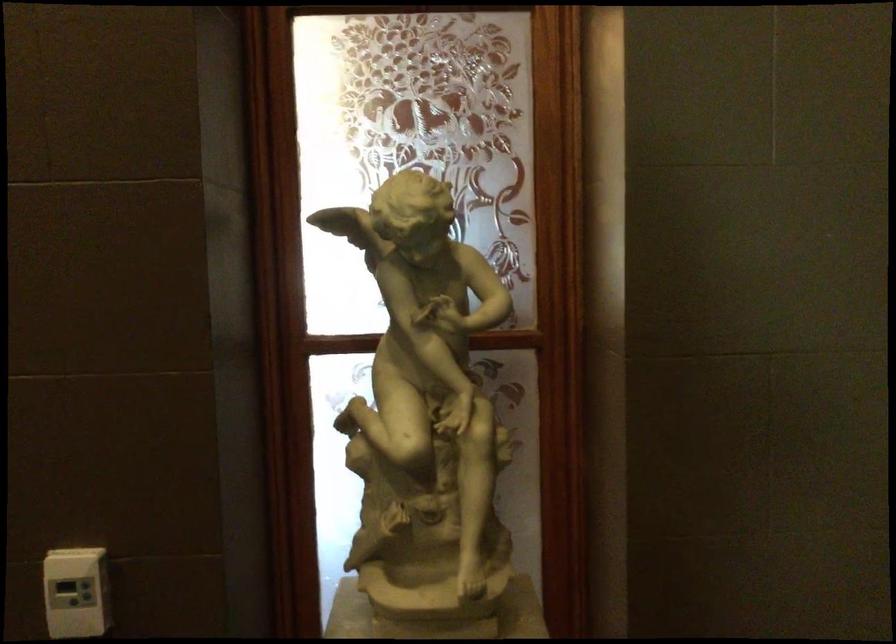
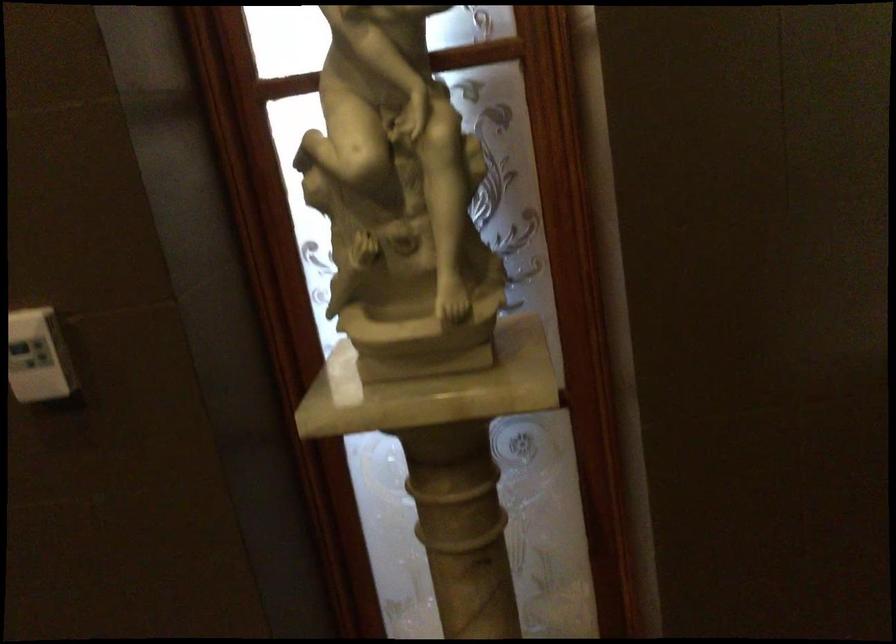
What movement of the cameraman would produce the second image?

The cameraman walked toward right, forward.